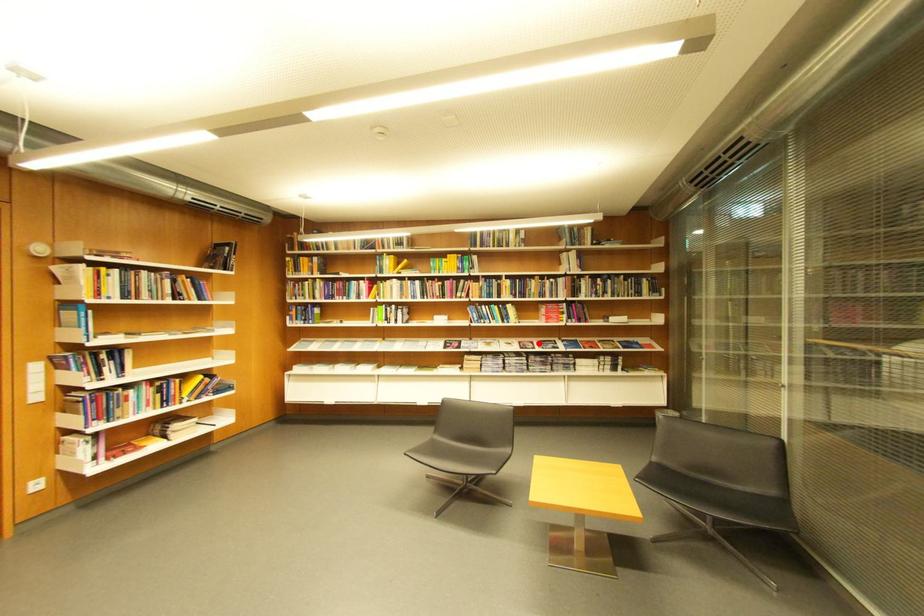
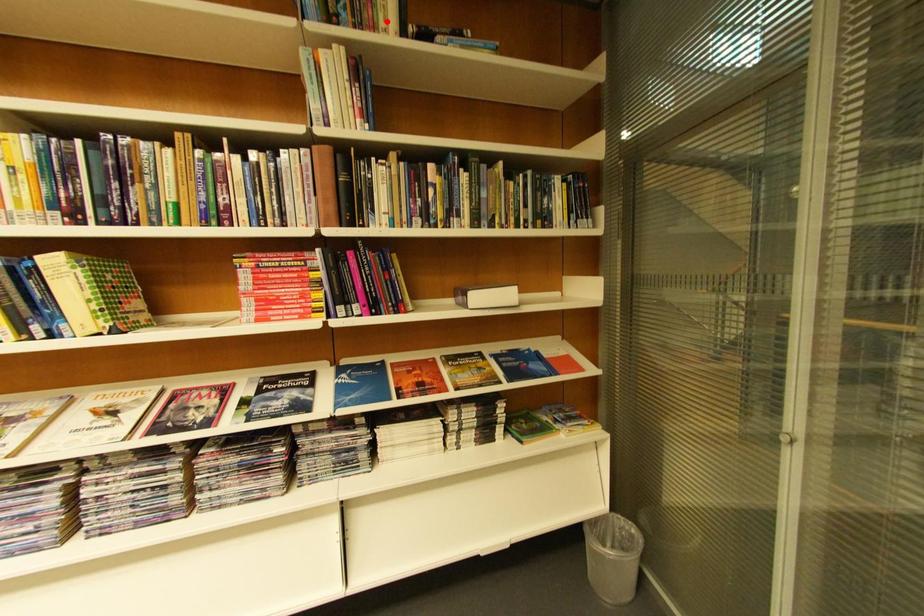
I am providing you with two images of the same scene from different viewpoints. A red point is marked on the first image and another point is marked on the second image. Do the highlighted points in image1 and image2 indicate the same real-world spot?

No